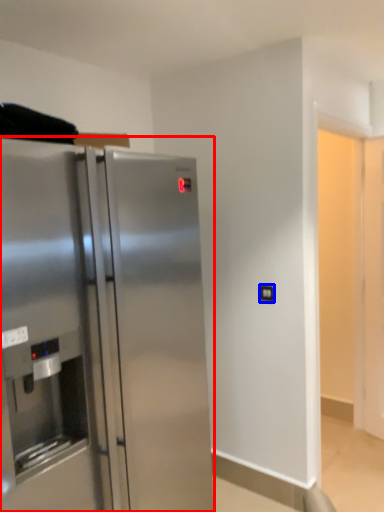
Question: Which of the following is the closest to the observer, refrigerator (highlighted by a red box) or electric outlet (highlighted by a blue box)?

Choices:
 (A) refrigerator
 (B) electric outlet

Answer: (A)